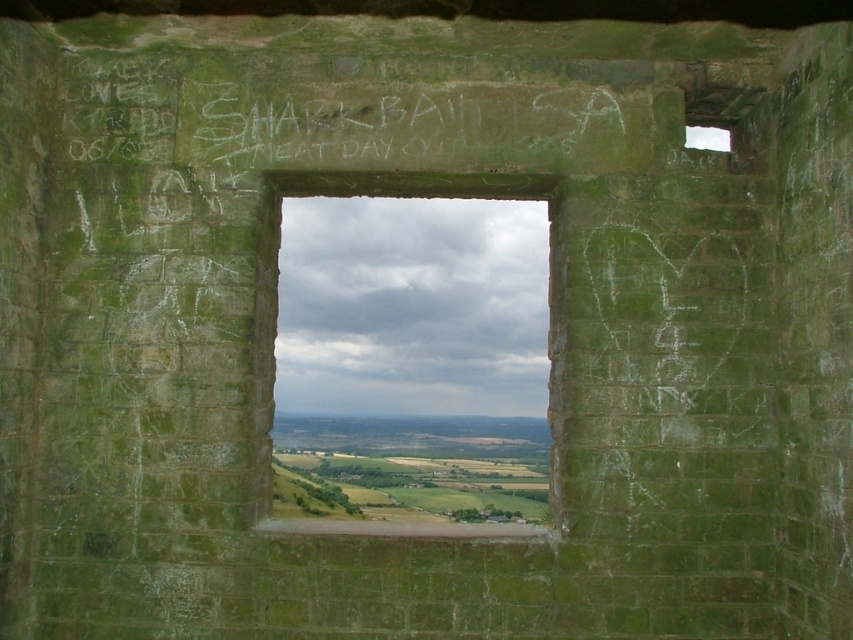
Can you confirm if green stone window at center is positioned to the left of white chalk graffiti at center?

Indeed, green stone window at center is positioned on the left side of white chalk graffiti at center.

Can you confirm if green stone window at center is smaller than white chalk graffiti at center?

Actually, green stone window at center might be larger than white chalk graffiti at center.

What do you see at coordinates (413, 307) in the screenshot?
I see `green stone window at center` at bounding box center [413, 307].

I want to click on green stone window at center, so [413, 307].